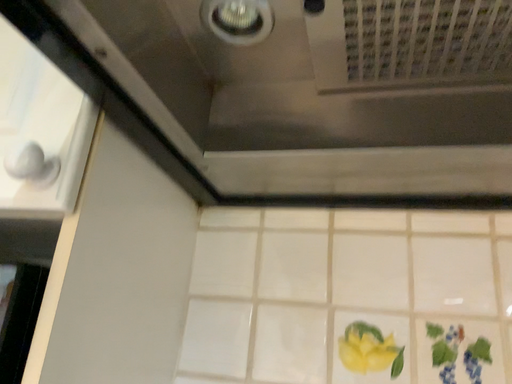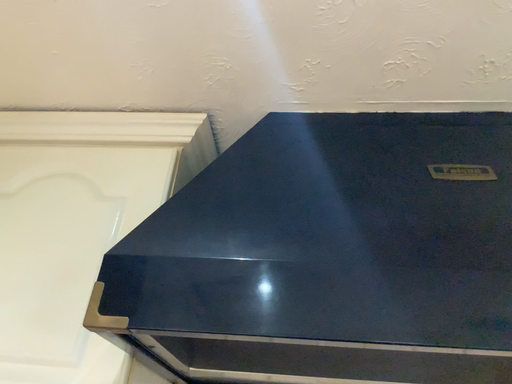
Question: Which way did the camera rotate in the video?

Choices:
 (A) rotated left
 (B) rotated right

Answer: (B)